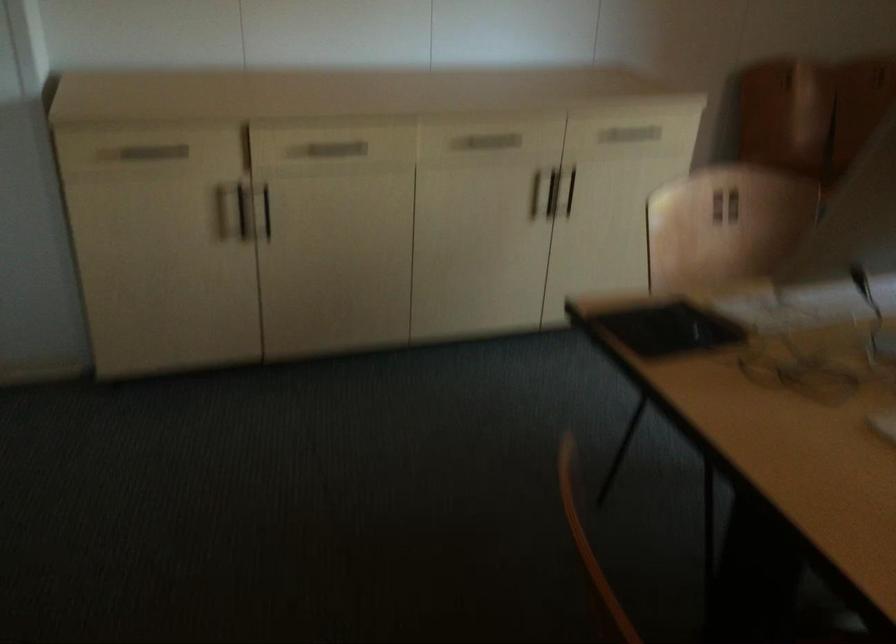
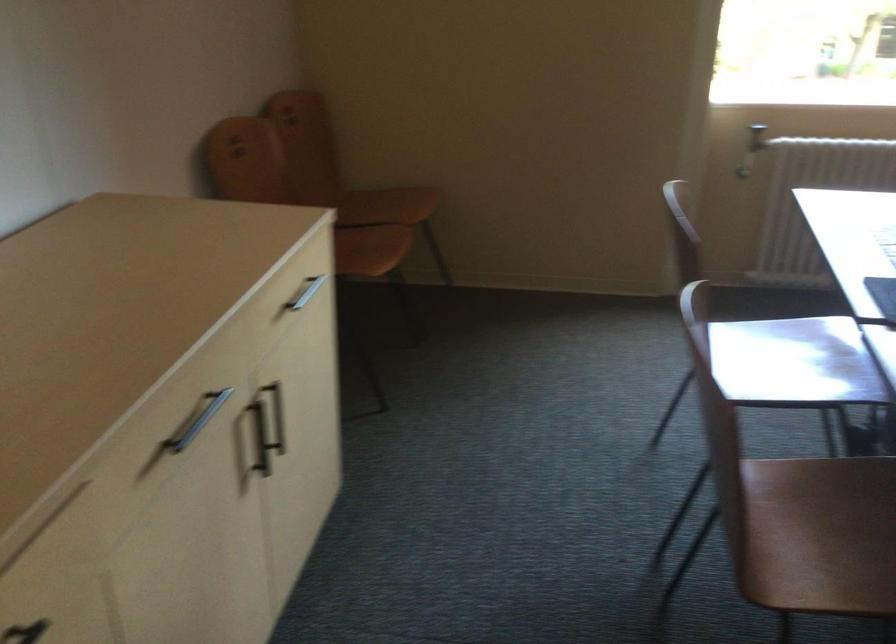
Where in the second image is the point corresponding to (x=496, y=146) from the first image?

(197, 420)